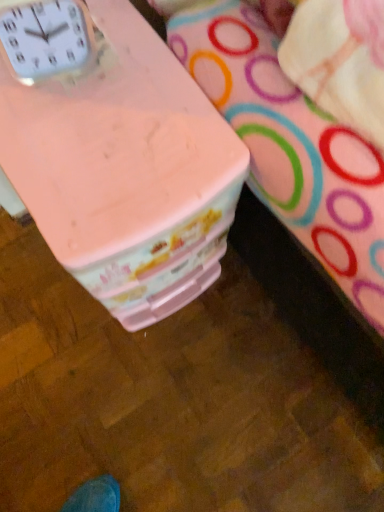
Question: From the image's perspective, is white plastic clock at upper left on pink plastic container at center?

Choices:
 (A) yes
 (B) no

Answer: (A)

Question: Is white plastic clock at upper left wider than pink plastic container at center?

Choices:
 (A) no
 (B) yes

Answer: (A)

Question: Does white plastic clock at upper left have a greater height compared to pink plastic container at center?

Choices:
 (A) yes
 (B) no

Answer: (B)

Question: Is white plastic clock at upper left smaller than pink plastic container at center?

Choices:
 (A) yes
 (B) no

Answer: (A)

Question: Can you confirm if white plastic clock at upper left is positioned to the right of pink plastic container at center?

Choices:
 (A) no
 (B) yes

Answer: (A)

Question: Are white plastic clock at upper left and pink plastic container at center beside each other?

Choices:
 (A) yes
 (B) no

Answer: (B)

Question: Is pink plastic container at center at the right side of white plastic clock at upper left?

Choices:
 (A) yes
 (B) no

Answer: (A)

Question: Is the position of pink plastic container at center more distant than that of white plastic clock at upper left?

Choices:
 (A) no
 (B) yes

Answer: (B)

Question: Does pink plastic container at center have a greater height compared to white plastic clock at upper left?

Choices:
 (A) no
 (B) yes

Answer: (B)

Question: From the image's perspective, is pink plastic container at center below white plastic clock at upper left?

Choices:
 (A) yes
 (B) no

Answer: (A)

Question: Does pink plastic container at center have a larger size compared to white plastic clock at upper left?

Choices:
 (A) yes
 (B) no

Answer: (A)

Question: Considering the relative sizes of pink plastic container at center and white plastic clock at upper left in the image provided, is pink plastic container at center shorter than white plastic clock at upper left?

Choices:
 (A) yes
 (B) no

Answer: (B)

Question: Based on their sizes in the image, would you say pink plastic container at center is bigger or smaller than white plastic clock at upper left?

Choices:
 (A) small
 (B) big

Answer: (B)